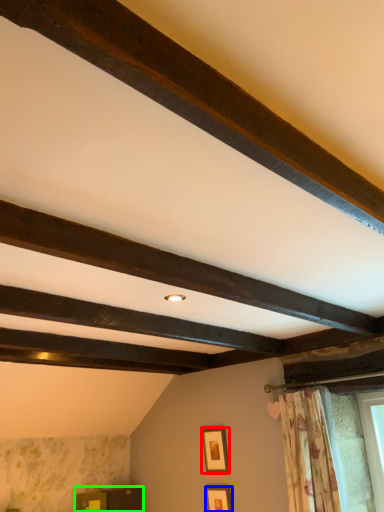
Question: Which is nearer to the picture frame (highlighted by a red box)? picture frame (highlighted by a blue box) or furniture (highlighted by a green box).

Choices:
 (A) picture frame
 (B) furniture

Answer: (A)